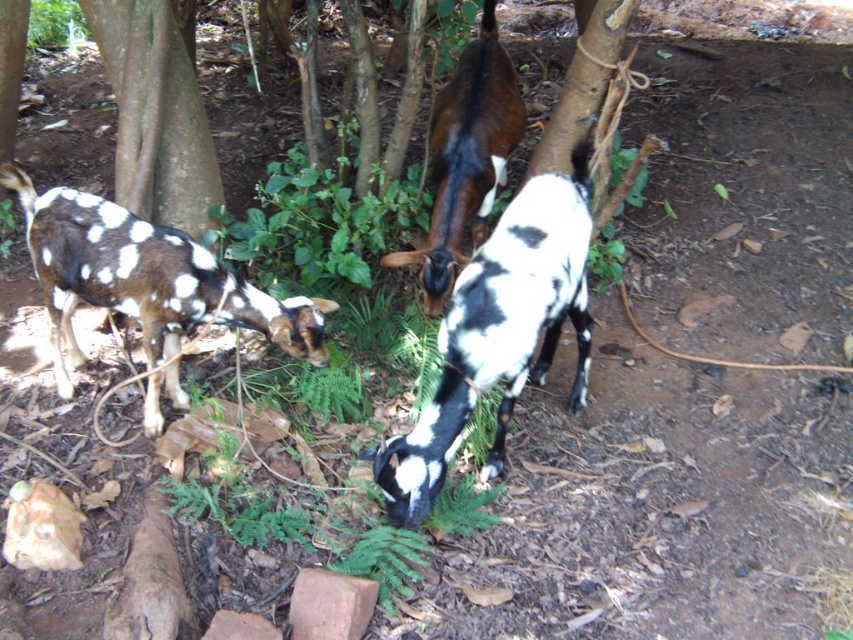
You are a farmer who needs to secure the spotted fur goat at center with a rope. The red clay brick at lower center is nearby. Can you reach the brick from the goat using a 30 inch rope?

The spotted fur goat at center is 29.15 inches from red clay brick at lower center. Since the rope is 30 inches long, it is just long enough to reach the brick from the goat.

You are standing in the field and want to feed the spotted fur goat at left. If your reach is 8 feet, can you feed it without moving closer?

The spotted fur goat at left is 9.30 feet away from you, so you cannot reach it with an 8 feet reach. You need to move closer.